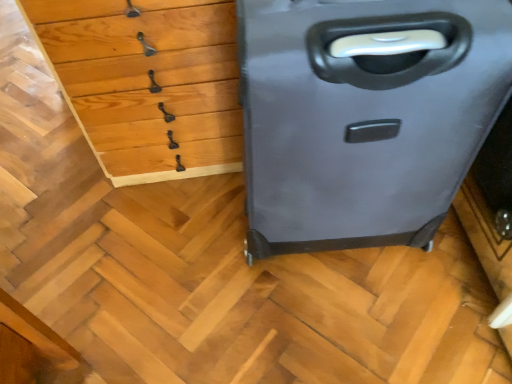
Where is `free spot to the left of wooden chest of drawers at upper left`? Image resolution: width=512 pixels, height=384 pixels. free spot to the left of wooden chest of drawers at upper left is located at coordinates (45, 156).